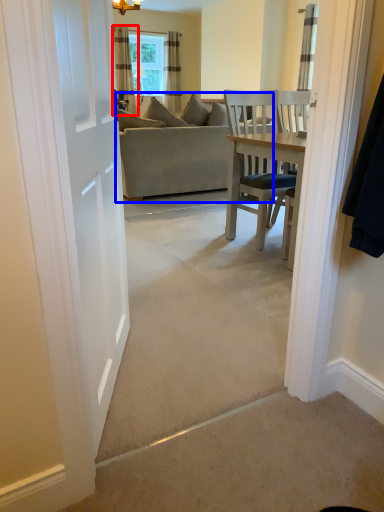
Question: Which point is further to the camera, curtain (highlighted by a red box) or studio couch (highlighted by a blue box)?

Choices:
 (A) curtain
 (B) studio couch

Answer: (A)